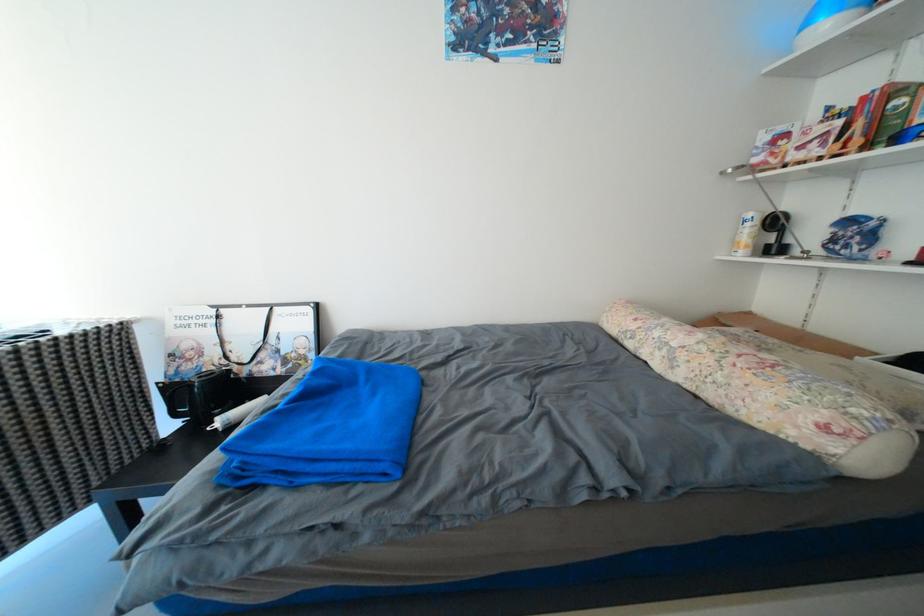
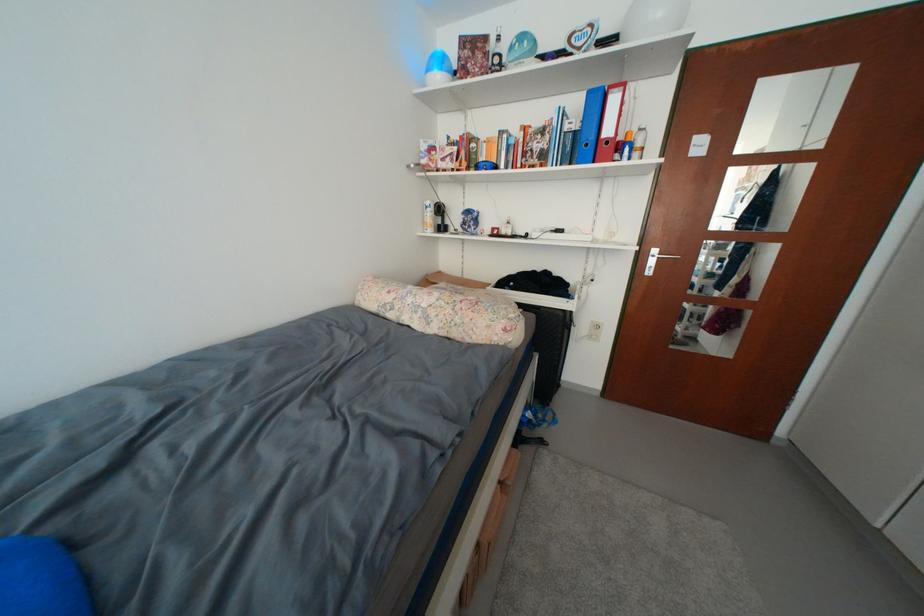
Find the pixel in the second image that matches [743,246] in the first image.

(432, 225)